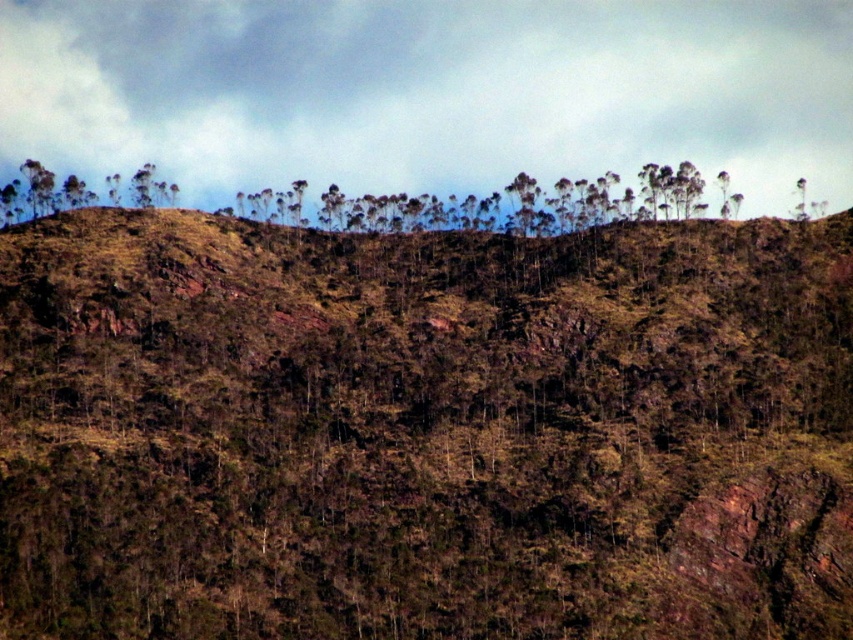
Who is positioned more to the right, brown rough hillside at upper center or cloudy sky at upper center?

brown rough hillside at upper center

Does point (167, 371) come behind point (184, 70)?

No, it is in front of (184, 70).

The image size is (853, 640). Find the location of `brown rough hillside at upper center`. brown rough hillside at upper center is located at coordinates (424, 429).